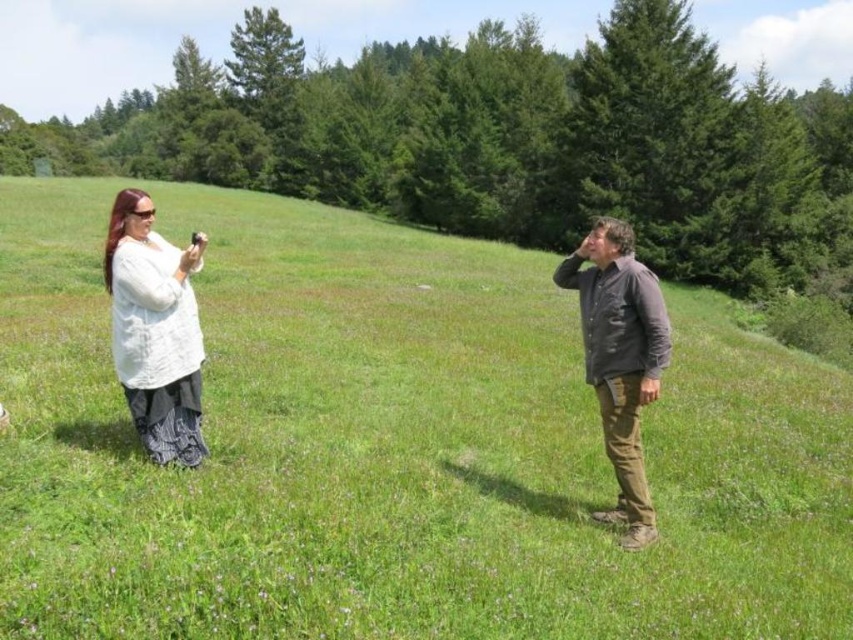
Between green grassy field at center and dark brown leather jacket at center, which one is positioned higher?

dark brown leather jacket at center is above.

Can you confirm if green grassy field at center is positioned to the left of dark brown leather jacket at center?

Indeed, green grassy field at center is positioned on the left side of dark brown leather jacket at center.

The width and height of the screenshot is (853, 640). What are the coordinates of `green grassy field at center` in the screenshot? It's located at (395, 445).

Is point (223, 611) positioned before point (165, 456)?

That is True.

Can you confirm if green grassy field at center is positioned above white textured shirt at left?

Indeed, green grassy field at center is positioned over white textured shirt at left.

Find the location of a particular element. The image size is (853, 640). green grassy field at center is located at coordinates (395, 445).

Does white textured shirt at left have a lesser height compared to dark brown leather jacket at center?

Yes, white textured shirt at left is shorter than dark brown leather jacket at center.

Does white textured shirt at left appear on the right side of dark brown leather jacket at center?

In fact, white textured shirt at left is to the left of dark brown leather jacket at center.

Measure the distance between point [178,268] and camera.

A distance of 5.18 meters exists between point [178,268] and camera.

Find the location of a particular element. Image resolution: width=853 pixels, height=640 pixels. white textured shirt at left is located at coordinates [x=155, y=330].